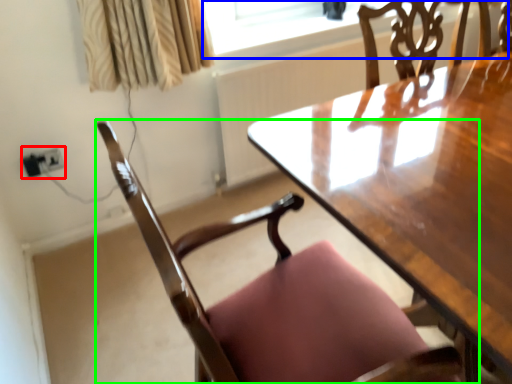
Question: Which object is the closest to the electric outlet (highlighted by a red box)? Choose among these: window screen (highlighted by a blue box) or chair (highlighted by a green box).

Choices:
 (A) window screen
 (B) chair

Answer: (A)